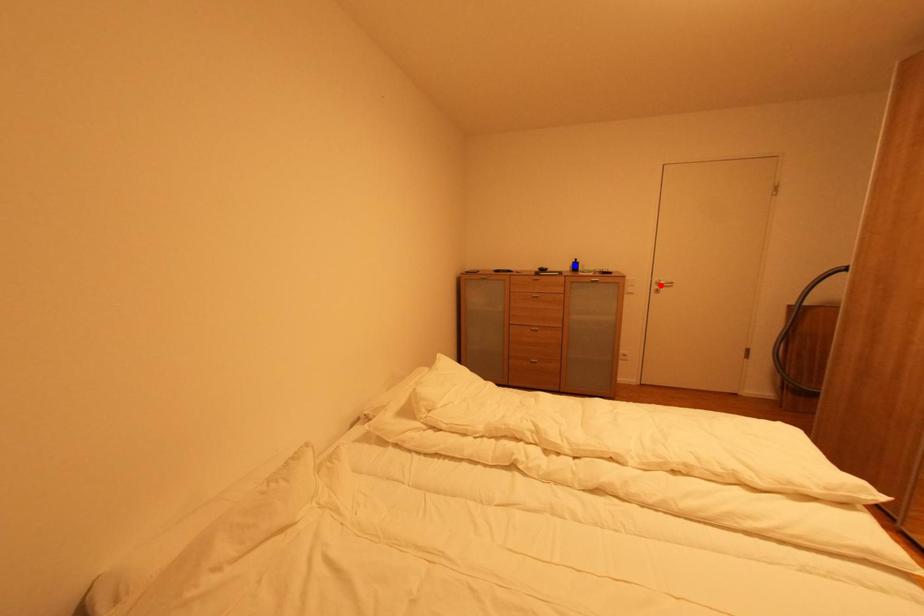
Question: Which of the two points in the image is closer to the camera?

Choices:
 (A) Blue point is closer.
 (B) Red point is closer.

Answer: (B)